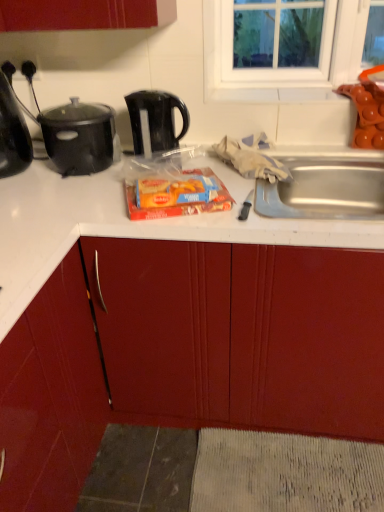
Find the location of a particular element. vacant region below shiny black kettle at left (from a real-world perspective) is located at coordinates click(x=14, y=175).